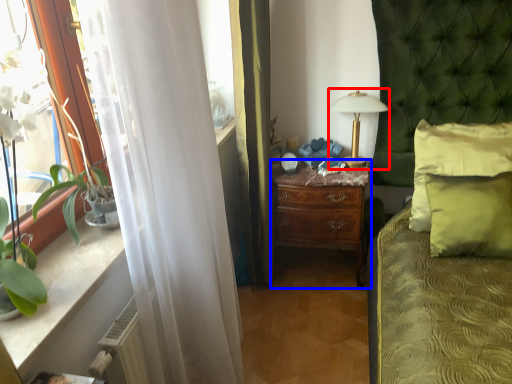
Question: Which object is further to the camera taking this photo, table lamp (highlighted by a red box) or nightstand (highlighted by a blue box)?

Choices:
 (A) table lamp
 (B) nightstand

Answer: (B)